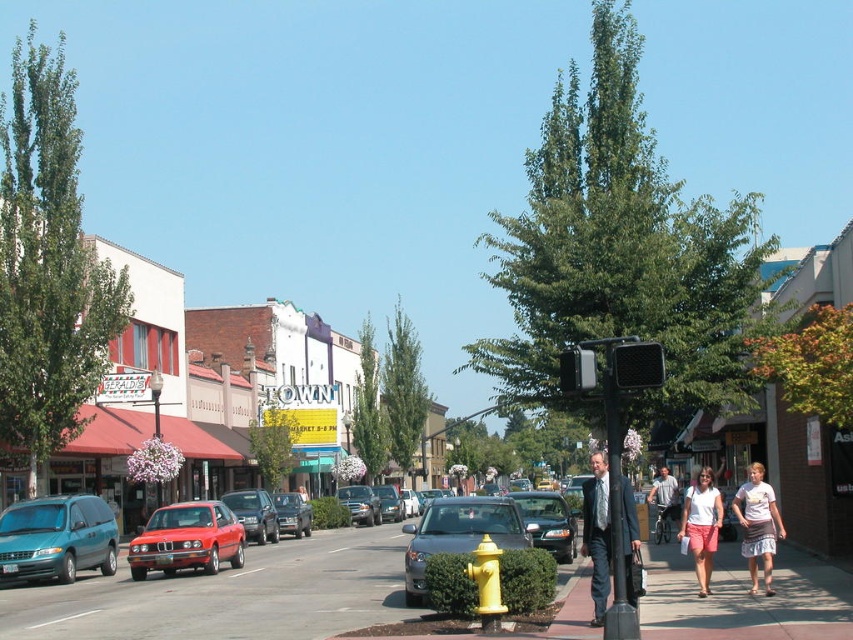
Does matte black sedan at center have a smaller size compared to shiny silver sedan at center?

Yes.

Is matte black sedan at center to the left of shiny silver sedan at center from the viewer's perspective?

Yes, matte black sedan at center is to the left of shiny silver sedan at center.

Which is in front, point (378, 506) or point (390, 492)?

Point (378, 506) is in front.

The height and width of the screenshot is (640, 853). I want to click on matte black sedan at center, so click(x=360, y=504).

Is the position of white cotton shirt at center more distant than that of metallic gray sedan at center?

No, white cotton shirt at center is closer to the viewer.

Can you confirm if white cotton shirt at center is positioned below metallic gray sedan at center?

Yes.

Who is more forward, (712, 512) or (527, 500)?

Point (712, 512) is in front.

This screenshot has height=640, width=853. I want to click on white cotton shirt at center, so click(701, 525).

Can you confirm if dark blue suit at center is wider than matte black sedan at center?

Correct, the width of dark blue suit at center exceeds that of matte black sedan at center.

Where is `dark blue suit at center`? dark blue suit at center is located at coordinates (596, 532).

This screenshot has height=640, width=853. Find the location of `dark blue suit at center`. dark blue suit at center is located at coordinates (596, 532).